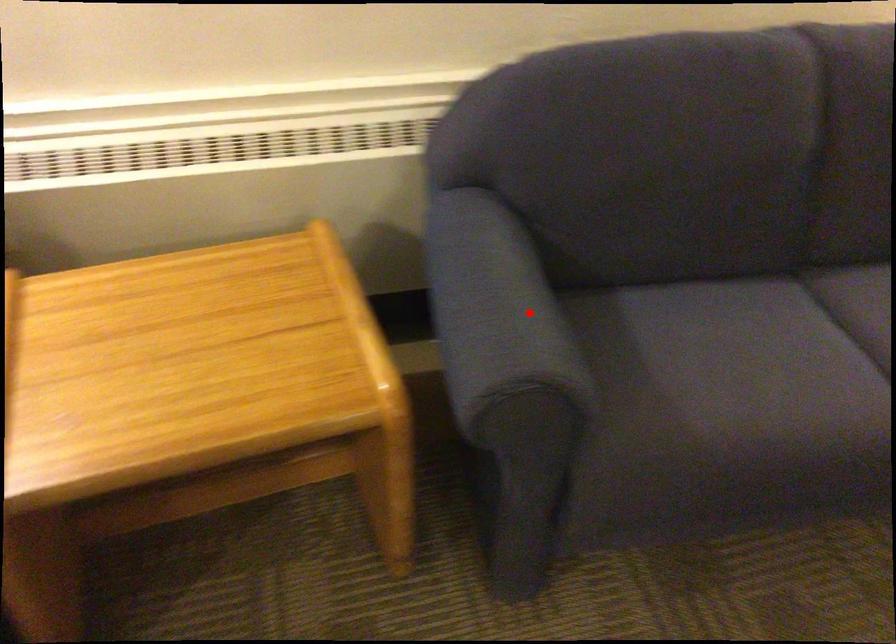
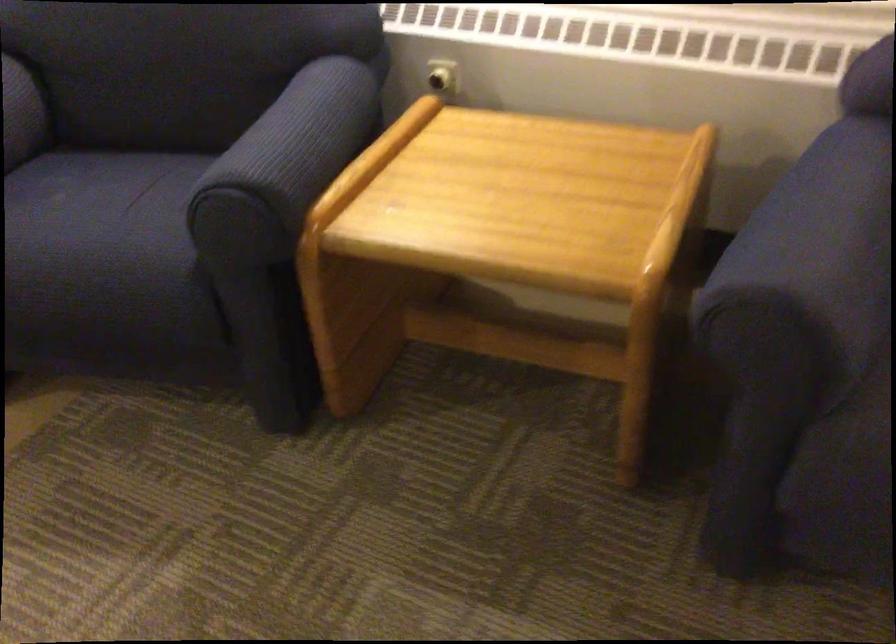
Question: I am providing you with two images of the same scene from different viewpoints. In image1, a red point is highlighted. Considering the same 3D point in image2, which of the following is correct?

Choices:
 (A) It is closer
 (B) It is farther

Answer: (A)